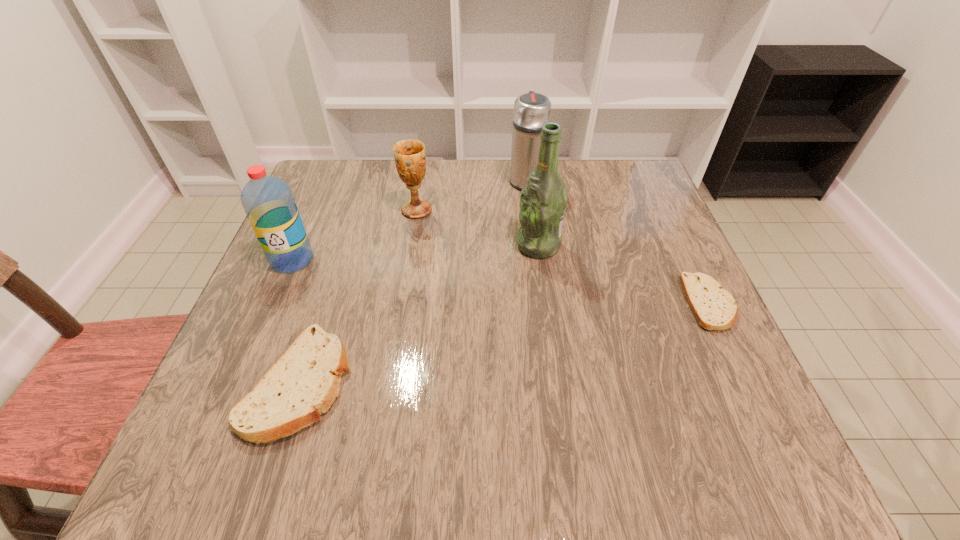
If the aim is uniform spacing by inserting an additional pita_(bread) among them, please point to a vacant space for this new pita_(bread). Please provide its 2D coordinates. Your answer should be formatted as a tuple, i.e. [(x, y)], where the tuple contains the x and y coordinates of a point satisfying the conditions above.

[(520, 340)]